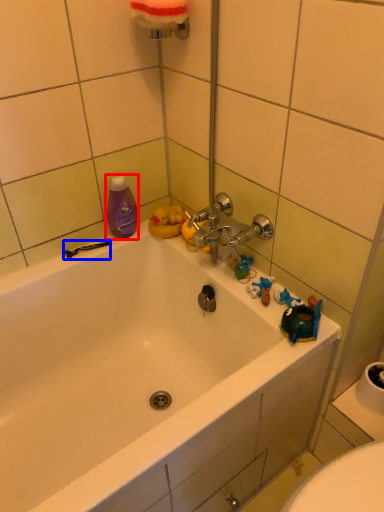
Question: Which object appears closest to the camera in this image, mouthwash (highlighted by a red box) or shower (highlighted by a blue box)?

Choices:
 (A) mouthwash
 (B) shower

Answer: (A)